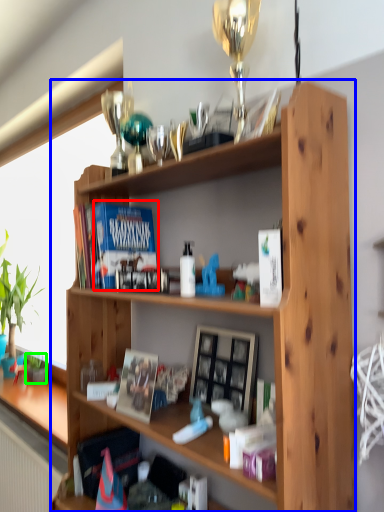
Question: Which is nearer to the paperback book (highlighted by a red box)? shelf (highlighted by a blue box) or houseplant (highlighted by a green box).

Choices:
 (A) shelf
 (B) houseplant

Answer: (A)